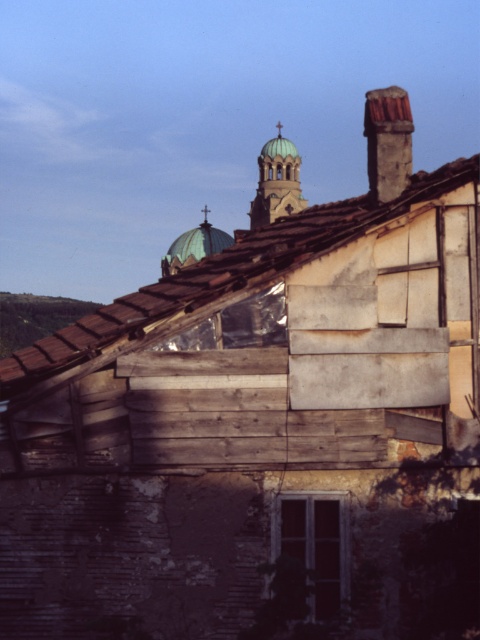
Question: Does brown shingles at upper left appear on the right side of rusty metal chimney at upper right?

Choices:
 (A) no
 (B) yes

Answer: (A)

Question: Which point is closer to the camera?

Choices:
 (A) (41, 371)
 (B) (295, 179)
 (C) (373, 124)

Answer: (A)

Question: Which of the following is the farthest from the observer?

Choices:
 (A) green glazed dome at upper center
 (B) rusty metal chimney at upper right

Answer: (A)

Question: Can you confirm if brown shingles at upper left is positioned below green glazed dome at upper center?

Choices:
 (A) no
 (B) yes

Answer: (B)

Question: Does brown shingles at upper left appear on the left side of rusty metal chimney at upper right?

Choices:
 (A) yes
 (B) no

Answer: (A)

Question: Which object is farther from the camera taking this photo?

Choices:
 (A) rusty metal chimney at upper right
 (B) brown shingles at upper left

Answer: (A)